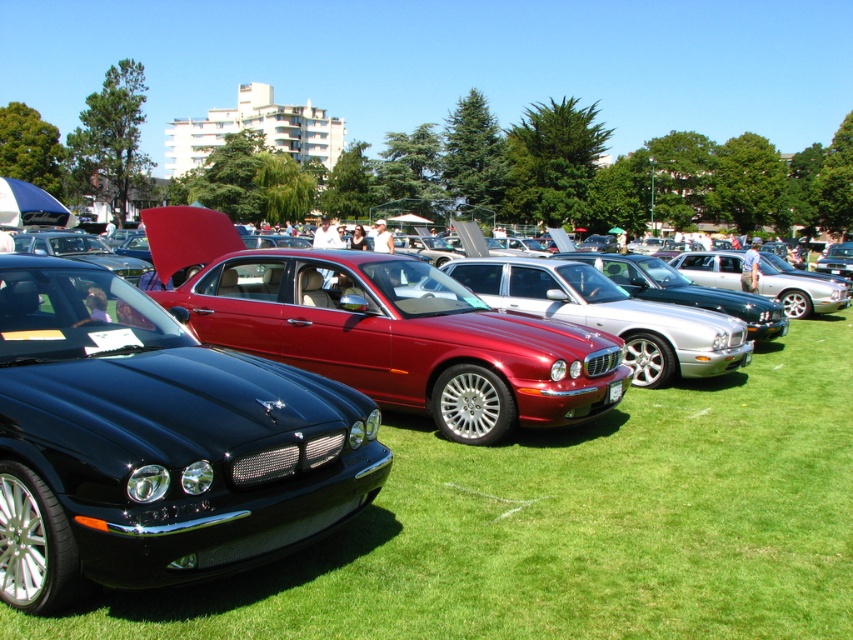
You are a photographer at the car show and want to capture both the shiny black sedan at center and the glossy metallic car at center in a single frame. Since you can only focus on one car at a time, which car should you focus on to ensure the other is still visible in the background?

You should focus on the shiny black sedan at center because it is positioned on the left side of the glossy metallic car at center, so the latter will still be visible in the background.

You are standing at the center of the grassy field at the car show. You want to locate the shiny black sedan at center. According to the coordinates provided, in which direction should you move from your current position to reach it?

The shiny black sedan at center is located at coordinates point (155, 442). Since you are at the center of the grassy field, you should move towards the direction of the coordinates to reach it.

You are standing at the point with coordinates (155, 442) in the car show image. Which car are you standing next to?

You are standing next to the shiny black sedan at center because the point (155, 442) is located on it.